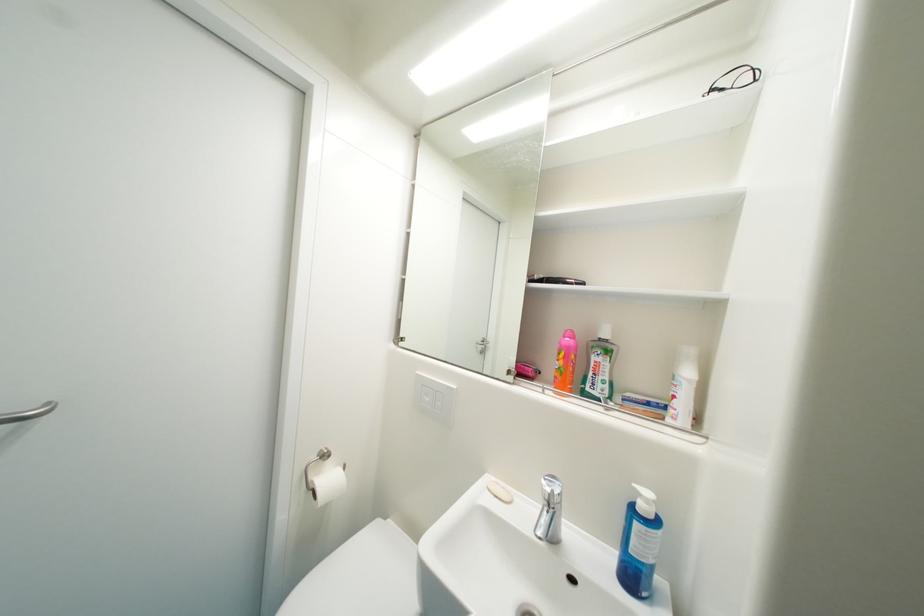
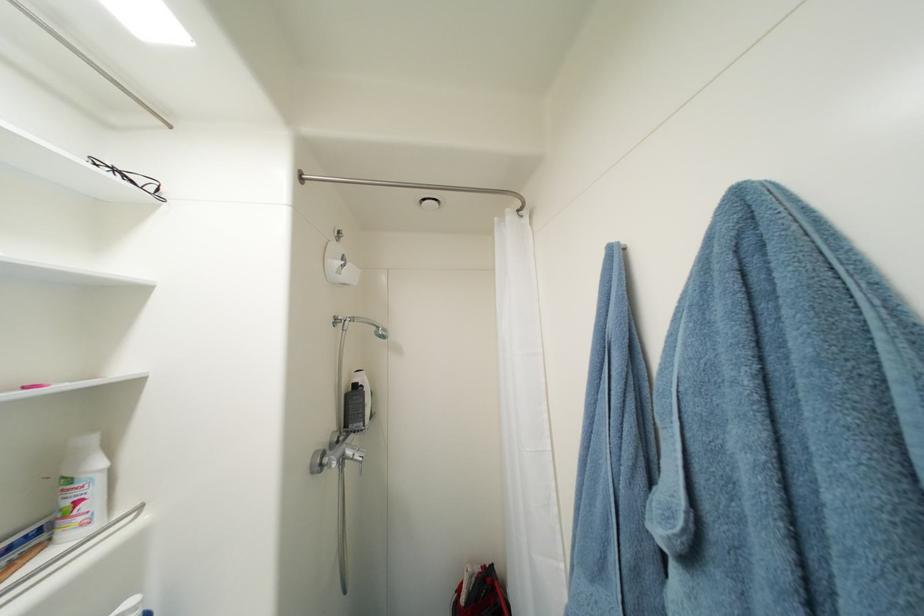
Find the pixel in the second image that matches (726,92) in the first image.

(140, 184)